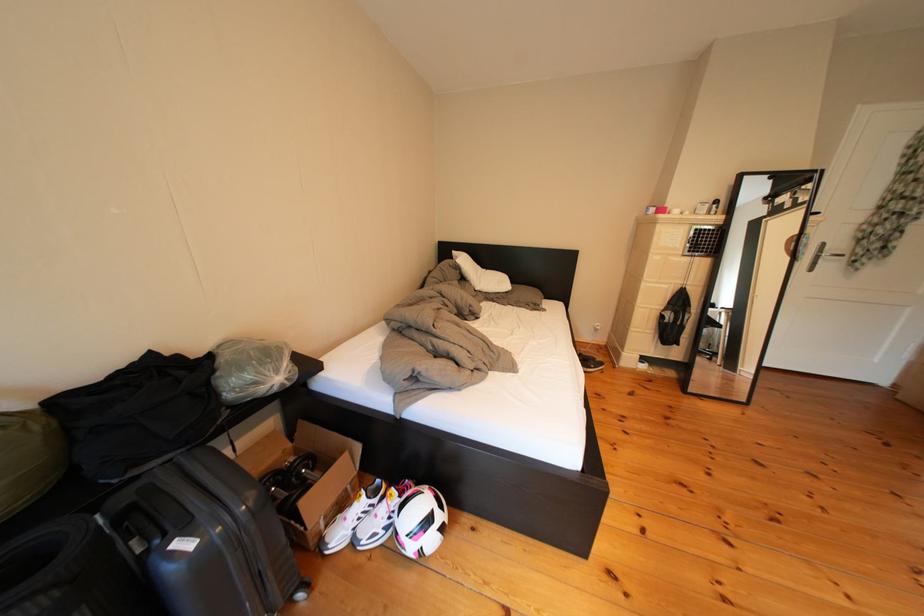
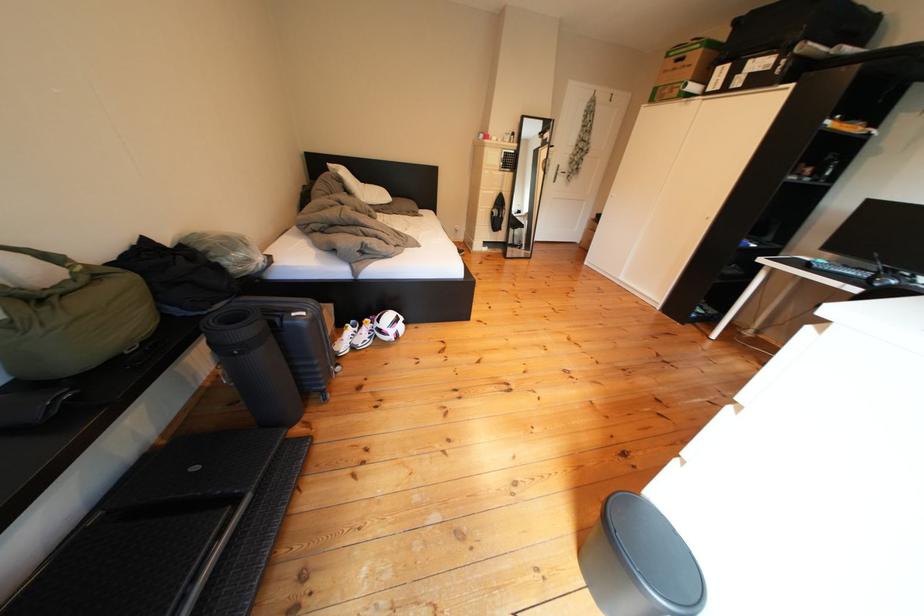
Find the pixel in the second image that matches point (128, 485) in the first image.

(217, 318)